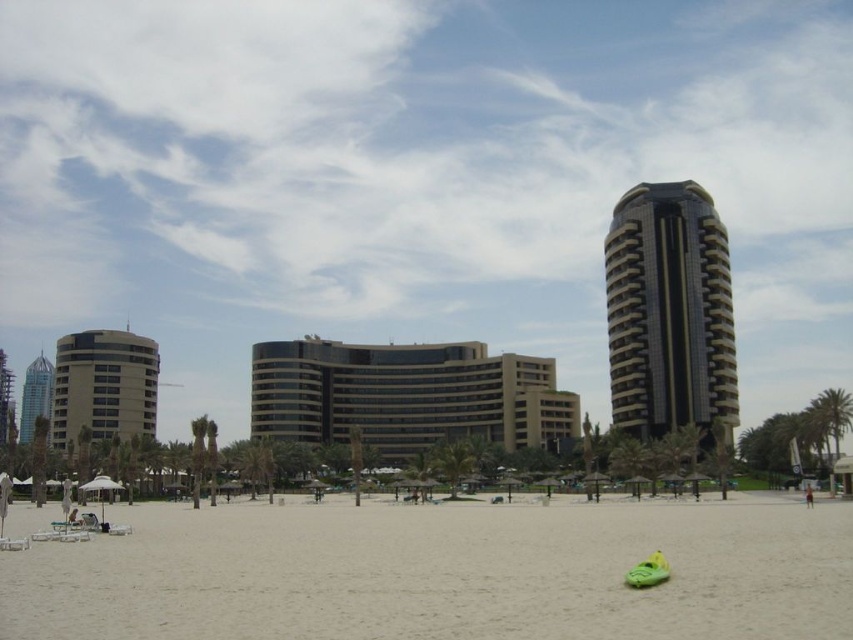
Question: Is white sand at lower center positioned at the back of shiny blue glass skyscraper at left?

Choices:
 (A) no
 (B) yes

Answer: (A)

Question: Observing the image, what is the correct spatial positioning of matte beige building at left in reference to green rubber kayak at lower center?

Choices:
 (A) right
 (B) left

Answer: (B)

Question: Is transparent glass skyscraper at center bigger than shiny blue glass skyscraper at left?

Choices:
 (A) no
 (B) yes

Answer: (B)

Question: Which of the following is the closest to the observer?

Choices:
 (A) shiny glass skyscraper at right
 (B) transparent glass skyscraper at center
 (C) matte beige building at left
 (D) shiny blue glass skyscraper at left

Answer: (B)

Question: Which point is closer to the camera taking this photo?

Choices:
 (A) (254, 81)
 (B) (367, 440)
 (C) (643, 564)

Answer: (C)

Question: Estimate the real-world distances between objects in this image. Which object is farther from the green rubber kayak at lower center?

Choices:
 (A) shiny blue glass skyscraper at left
 (B) skinny jeans at lower right
 (C) white sand at lower center

Answer: (A)